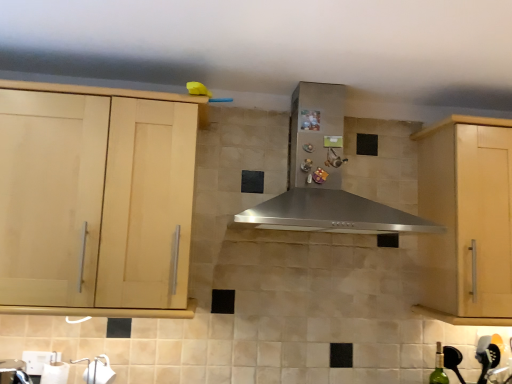
Question: Would you say light wood cabinet at left, arranged as the first cabinetry when viewed from the left, is to the left or to the right of green glass bottle at lower right in the picture?

Choices:
 (A) right
 (B) left

Answer: (B)

Question: In the image, is light wood cabinet at left, arranged as the first cabinetry when viewed from the left, positioned in front of or behind green glass bottle at lower right?

Choices:
 (A) behind
 (B) front

Answer: (B)

Question: Considering the real-world distances, which object is closest to the green glass bottle at lower right?

Choices:
 (A) light wood cabinet at left, arranged as the first cabinetry when viewed from the left
 (B) light wood cabinet at right, placed as the first cabinetry when sorted from right to left
 (C) stainless steel range hood at center

Answer: (B)

Question: Which of these objects is positioned closest to the light wood cabinet at left, arranged as the first cabinetry when viewed from the left?

Choices:
 (A) light wood cabinet at right, placed as the first cabinetry when sorted from right to left
 (B) green glass bottle at lower right
 (C) stainless steel range hood at center

Answer: (C)